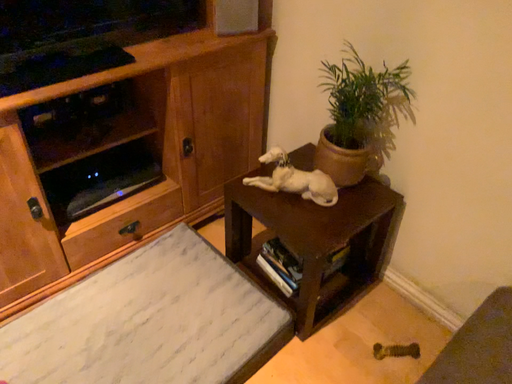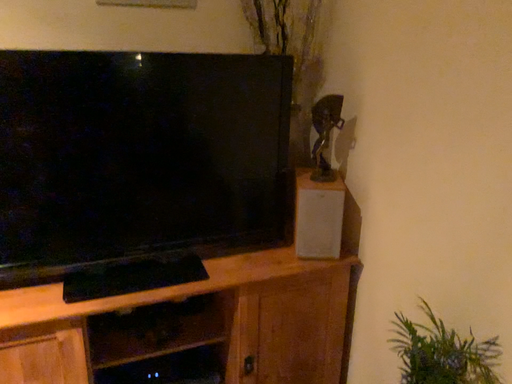
Question: Which way did the camera rotate in the video?

Choices:
 (A) rotated upward
 (B) rotated downward

Answer: (A)